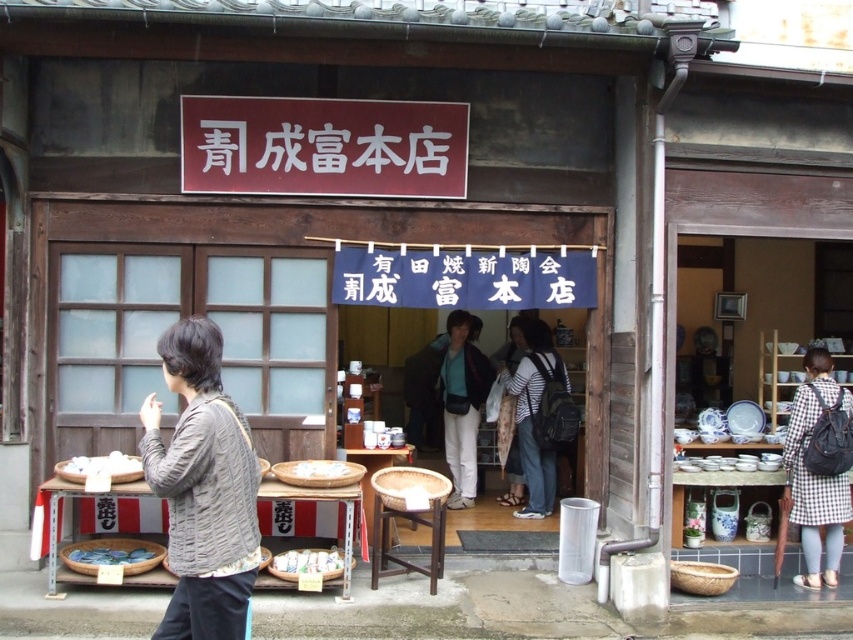
Who is positioned more to the left, checkered fabric dress at lower right or white matte bowl at lower left?

white matte bowl at lower left

Which is above, checkered fabric dress at lower right or white matte bowl at lower left?

Positioned higher is white matte bowl at lower left.

The image size is (853, 640). Find the location of `checkered fabric dress at lower right`. checkered fabric dress at lower right is located at coordinates (816, 474).

Between red matte sign at center and blue matte bowl at lower left, which one is positioned lower?

blue matte bowl at lower left is lower down.

Is red matte sign at center positioned in front of blue matte bowl at lower left?

No, red matte sign at center is behind blue matte bowl at lower left.

Does point (236, 154) lie behind point (144, 550)?

Yes, point (236, 154) is farther from viewer.

This screenshot has width=853, height=640. Identify the location of red matte sign at center. (323, 147).

Does matte black jacket at center have a greater height compared to white matte bowl at lower left?

Yes, matte black jacket at center is taller than white matte bowl at lower left.

Does point (480, 380) lie in front of point (68, 476)?

No.

Identify the location of matte black jacket at center. The image size is (853, 640). (462, 404).